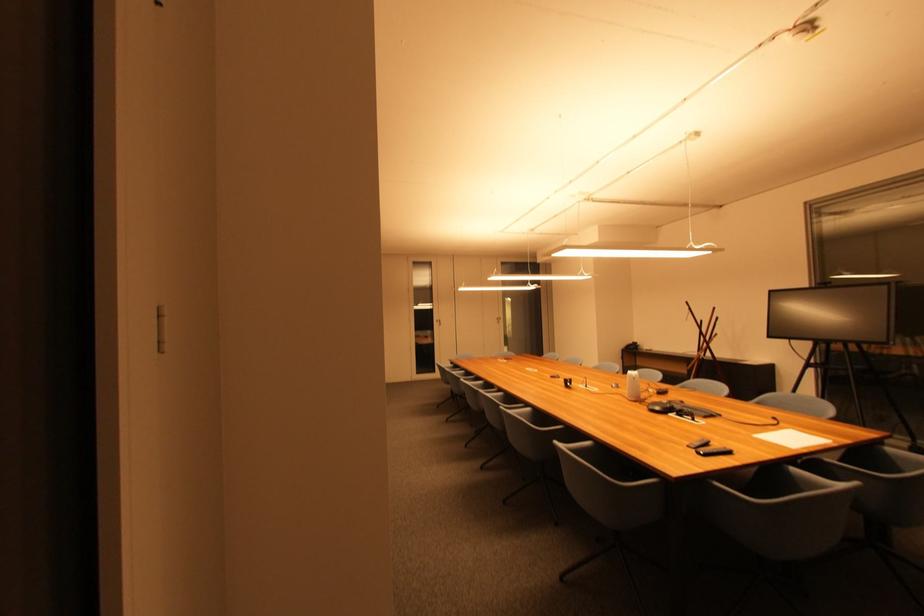
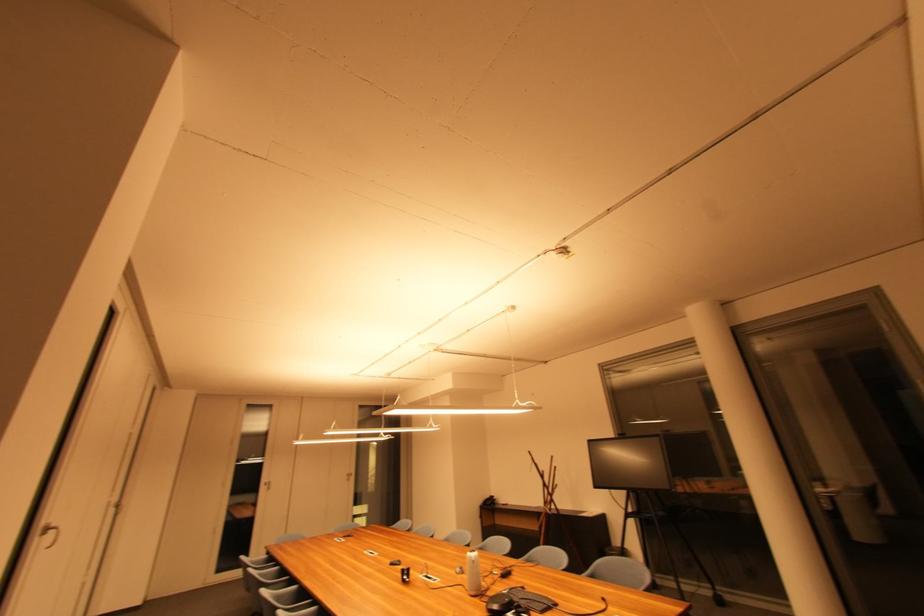
Locate, in the second image, the point that corresponds to (x=637, y=377) in the first image.

(477, 560)